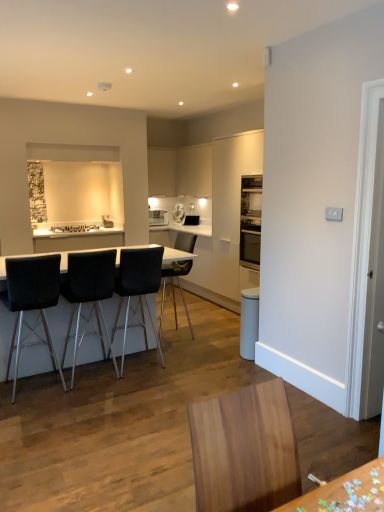
At what (x,y) coordinates should I click in order to perform the action: click on free spot to the right of black leather chair at center, marked as the fourth chair in a left-to-right arrangement. Please return your answer as a coordinate pair (x, y). This screenshot has height=512, width=384. Looking at the image, I should click on (216, 333).